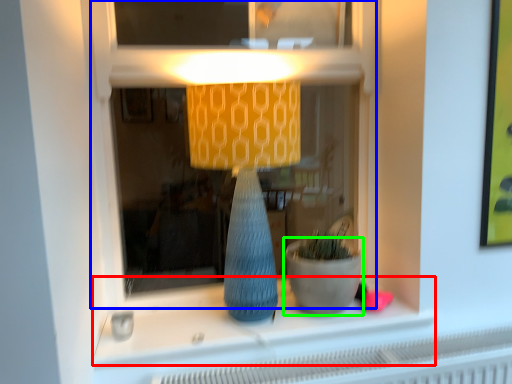
Question: Which is nearer to the window sill (highlighted by a red box)? shop window (highlighted by a blue box) or flowerpot (highlighted by a green box).

Choices:
 (A) shop window
 (B) flowerpot

Answer: (B)